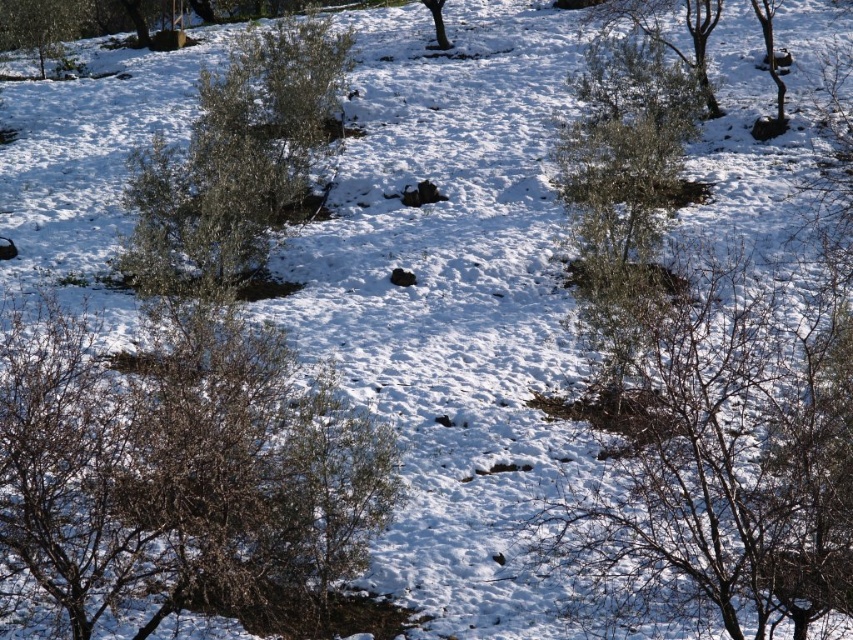
Question: Is brown textured bush at lower left smaller than green matte tree at center?

Choices:
 (A) no
 (B) yes

Answer: (B)

Question: Where is bare branches at center located in relation to green leafy tree at center in the image?

Choices:
 (A) below
 (B) above

Answer: (A)

Question: Which object is the closest to the green matte tree at center?

Choices:
 (A) green leafy shrub at upper right
 (B) green leafy tree at upper left
 (C) bare branches at center
 (D) green leafy shrub at center

Answer: (D)

Question: Based on their relative distances, which object is farther from the green leafy tree at upper left?

Choices:
 (A) bare branches at upper right
 (B) green leafy shrub at center

Answer: (B)

Question: Can you confirm if green leafy shrub at center is thinner than green leafy shrub at upper right?

Choices:
 (A) no
 (B) yes

Answer: (A)

Question: Which point appears farthest from the camera in this image?

Choices:
 (A) (439, 26)
 (B) (585, 161)
 (C) (769, 16)

Answer: (A)